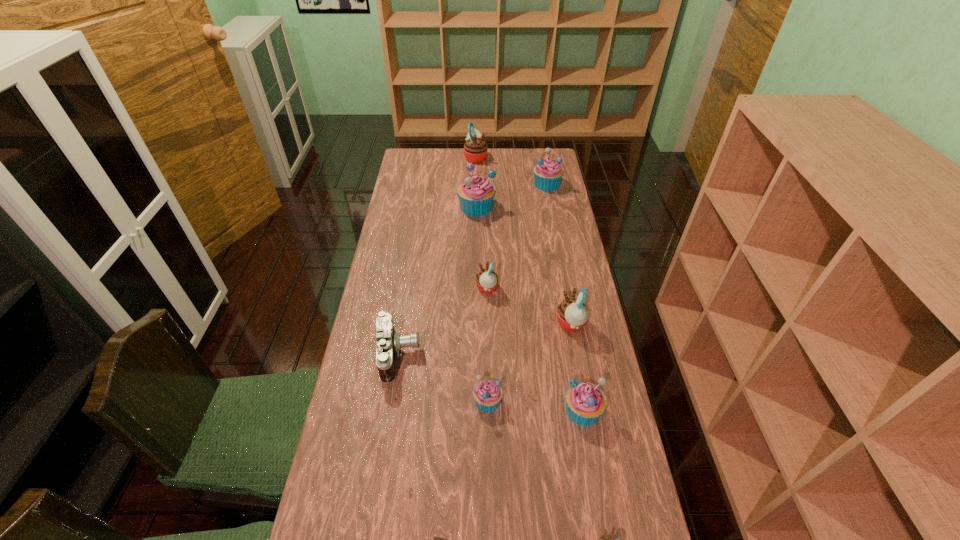
Where is `free space located on the front-facing side of the fourth farthest muffin`? free space located on the front-facing side of the fourth farthest muffin is located at coordinates pyautogui.click(x=421, y=288).

Locate an element on the screen. The height and width of the screenshot is (540, 960). vacant space located 0.300m on the front-facing side of the fourth farthest muffin is located at coordinates (391, 288).

The image size is (960, 540). Find the location of `free spot located 0.280m on the front-facing side of the fourth farthest muffin`. free spot located 0.280m on the front-facing side of the fourth farthest muffin is located at coordinates (396, 288).

I want to click on vacant point located at the lens of the leftmost object, so click(x=496, y=356).

I want to click on vacant space located on the left of the smallest blue muffin, so click(x=423, y=401).

Locate an element on the screen. object that is positioned at the far edge is located at coordinates (475, 149).

Locate an element on the screen. object that is at the left edge is located at coordinates click(x=388, y=343).

In the image, there is a desktop. Where is `free space at the far edge`? free space at the far edge is located at coordinates (514, 158).

Identify the location of vacant space at the left edge of the desktop. Image resolution: width=960 pixels, height=540 pixels. (381, 306).

The width and height of the screenshot is (960, 540). In the image, there is a desktop. In order to click on vacant space at the right edge in this screenshot , I will do `click(610, 417)`.